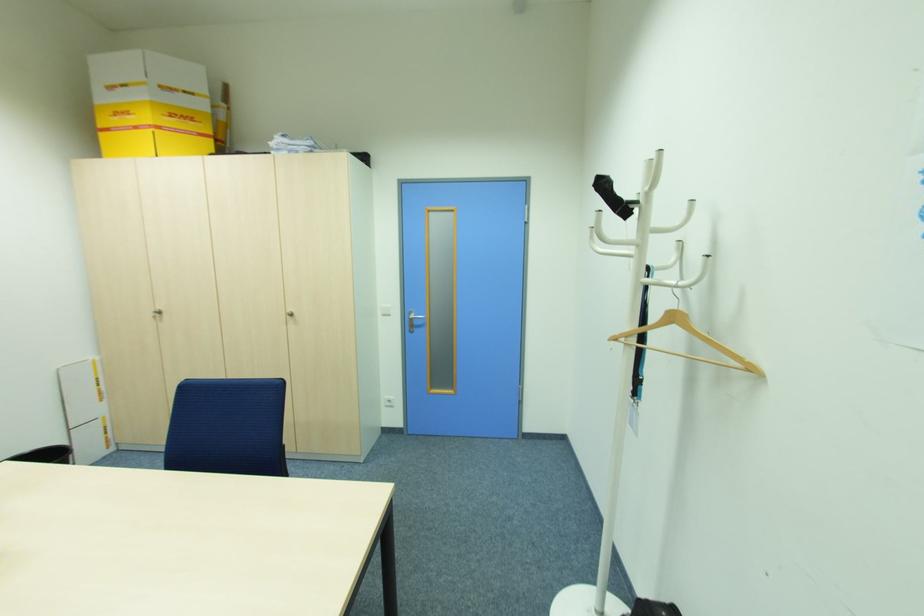
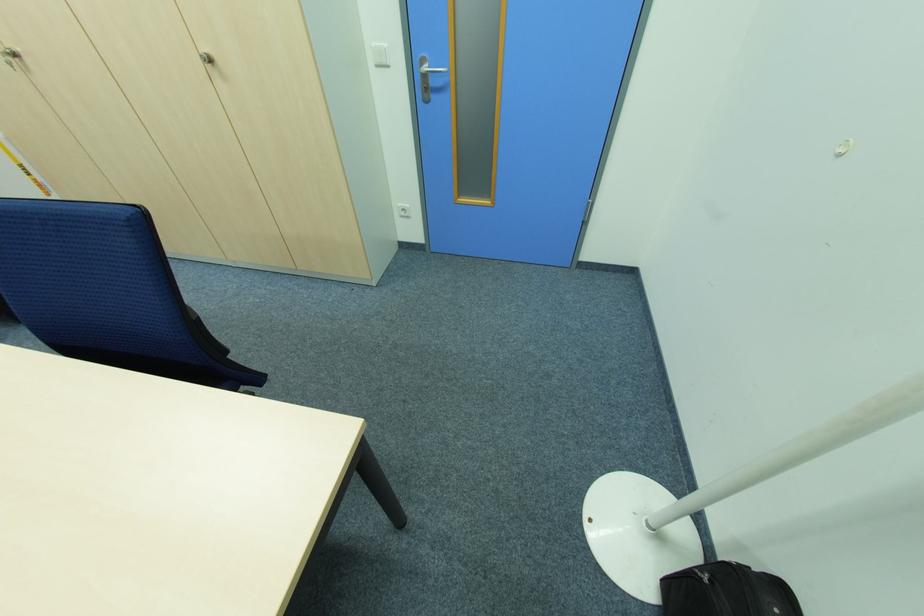
Find the pixel in the second image that matches point (294, 314) in the first image.

(213, 62)